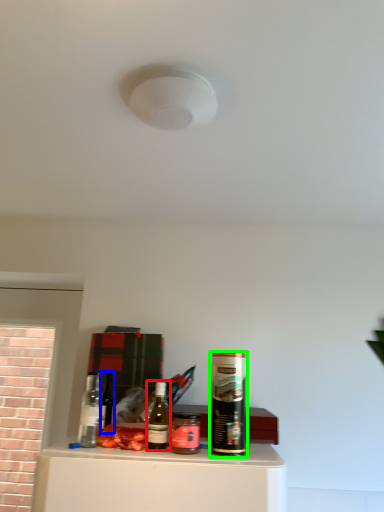
Question: Which object is positioned farthest from bottle (highlighted by a red box)? Select from wine bottle (highlighted by a blue box) and beverage (highlighted by a green box).

Choices:
 (A) wine bottle
 (B) beverage

Answer: (A)